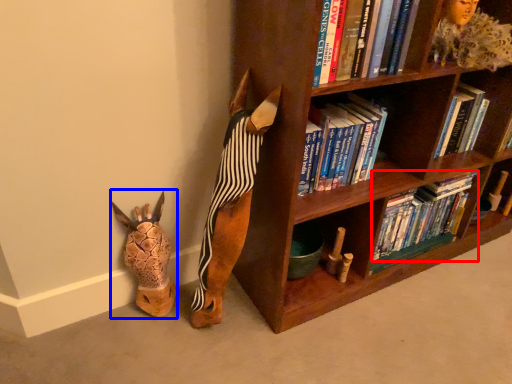
Question: Which object is closer to the camera taking this photo, book (highlighted by a red box) or animal (highlighted by a blue box)?

Choices:
 (A) book
 (B) animal

Answer: (B)